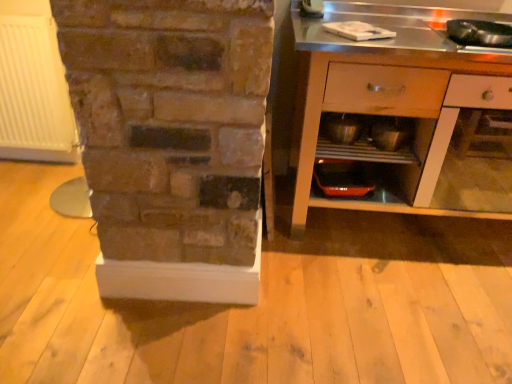
Question: From a real-world perspective, relative to metallic silver bowl at center, is metallic silver shelf at lower center vertically above or below?

Choices:
 (A) below
 (B) above

Answer: (B)

Question: From the image's perspective, is metallic silver shelf at lower center located above or below metallic silver bowl at center?

Choices:
 (A) below
 (B) above

Answer: (A)

Question: Based on their relative distances, which object is farther from the metallic silver shelf at lower center?

Choices:
 (A) metallic silver cabinet at right
 (B) white matte radiator at left
 (C) metallic silver bowl at center

Answer: (B)

Question: Which of these objects is positioned closest to the metallic silver shelf at lower center?

Choices:
 (A) white matte radiator at left
 (B) metallic silver cabinet at right
 (C) metallic silver bowl at center

Answer: (C)